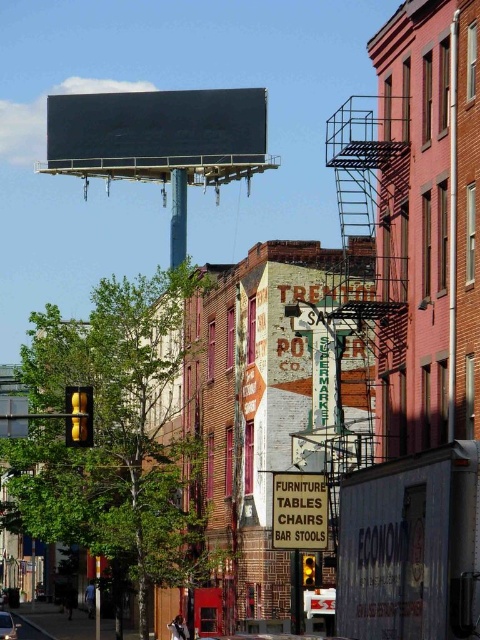
You are a city planner reviewing this urban scene. There is a point marked at coordinates (300, 512). What does this point indicate?

The point at (300, 512) marks the location of the white cardboard sign at center.